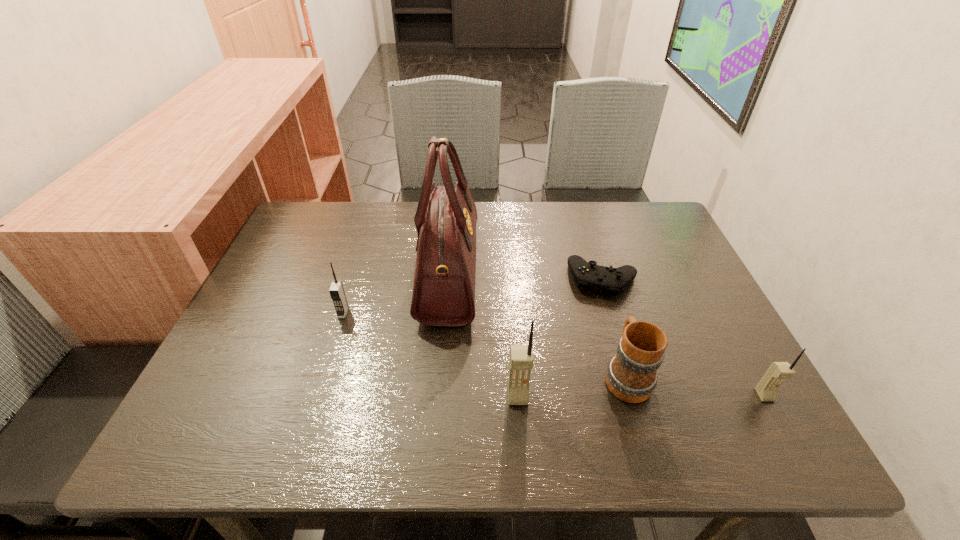
The width and height of the screenshot is (960, 540). Find the location of `unoccupied position between the mug and the tallest object`. unoccupied position between the mug and the tallest object is located at coordinates (538, 324).

Find the location of a particular element. This screenshot has width=960, height=540. empty space between the second cellular telephone from right to left and the tallest object is located at coordinates (483, 334).

I want to click on unoccupied area between the third object from left to right and the mug, so click(572, 386).

The width and height of the screenshot is (960, 540). I want to click on free space between the leftmost object and the third object from left to right, so click(430, 354).

At what (x,y) coordinates should I click in order to perform the action: click on vacant region between the fifth shortest object and the leftmost object. Please return your answer as a coordinate pair (x, y). Looking at the image, I should click on (430, 354).

The height and width of the screenshot is (540, 960). In order to click on empty space that is in between the mug and the handbag in this screenshot , I will do `click(538, 324)`.

Locate an element on the screen. The image size is (960, 540). object that is the second closest to the rightmost cellular telephone is located at coordinates (613, 281).

Identify the location of the fifth closest object relative to the mug. Image resolution: width=960 pixels, height=540 pixels. (337, 293).

This screenshot has width=960, height=540. Find the location of `cellular telephone that is the closest to the rightmost object`. cellular telephone that is the closest to the rightmost object is located at coordinates (521, 359).

I want to click on cellular telephone that is the second closest to the shortest object, so click(766, 389).